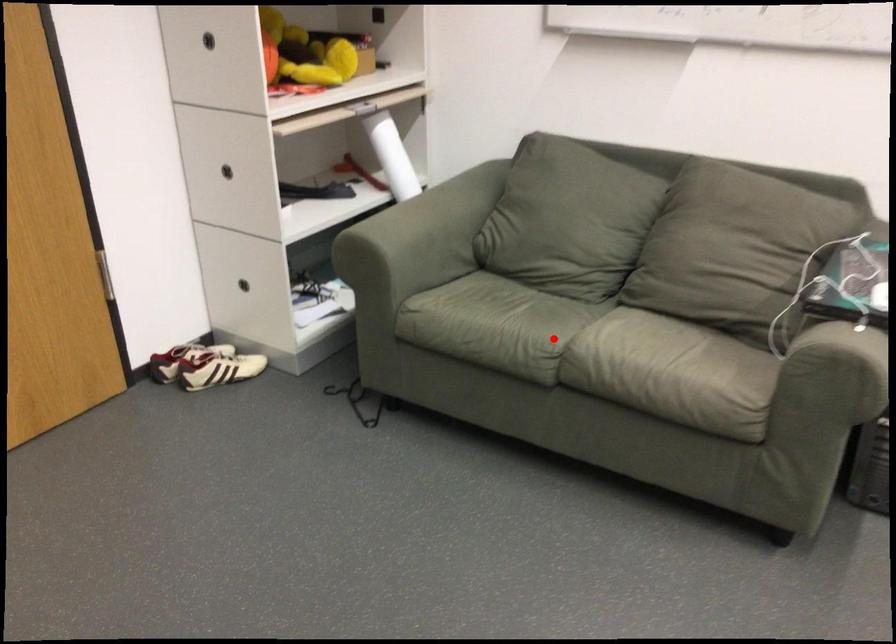
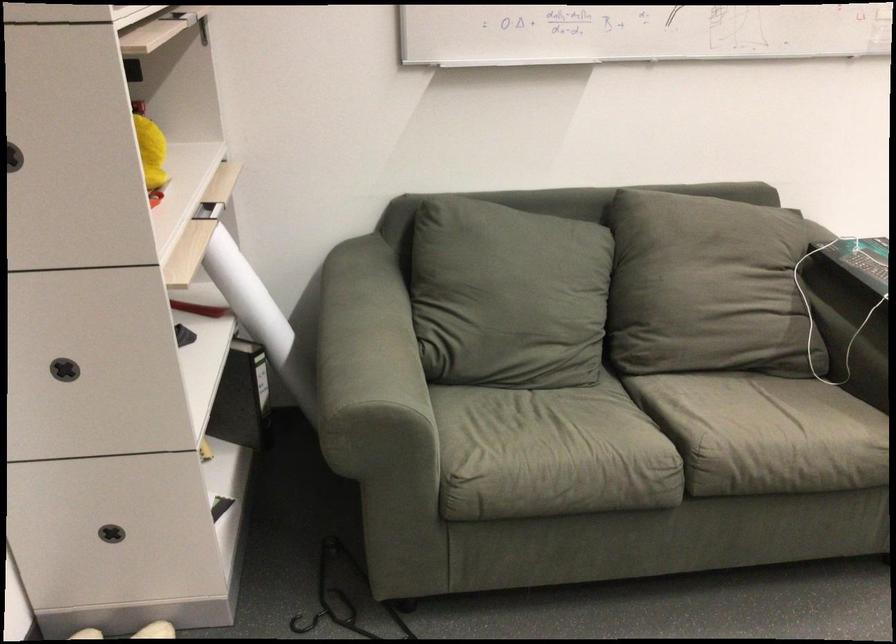
Find the pixel in the second image that matches the highlighted location in the first image.

(653, 444)